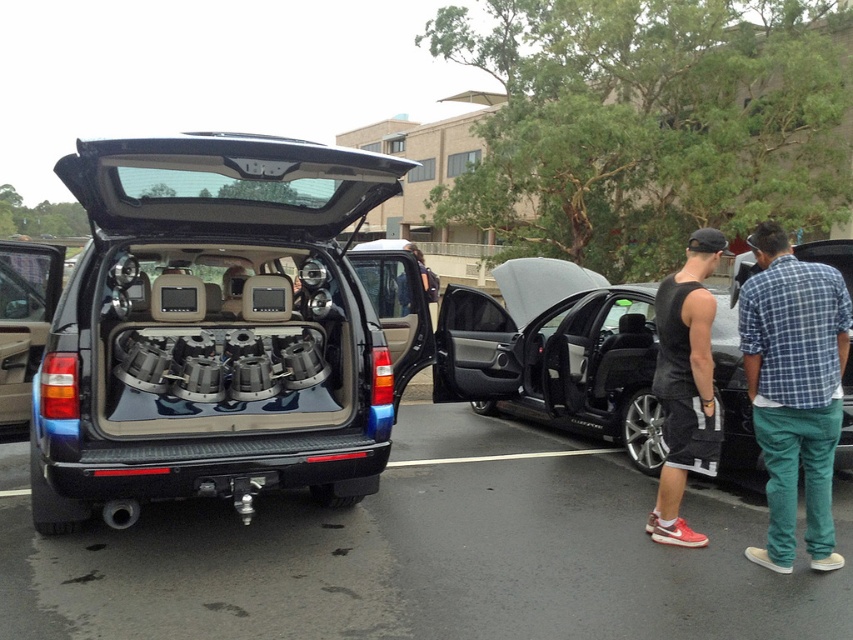
You are a delivery person standing at the camera position. You need to deliver a package to the shiny metallic minivan at center. The package requires a clear path of at least 3 meters to reach the vehicle. Is the distance sufficient for you to deliver the package without moving any other objects?

The shiny metallic minivan at center is 3.14 meters from camera. Since the required clear path is at least 3 meters, the distance is sufficient for delivery without moving any other objects.

You are a delivery person who needs to place a large package between the black plastic car at center and the blue plaid shirt at right. Which object should you place the package closer to if you want it to be near the smaller object?

The black plastic car at center is smaller than the blue plaid shirt at right, so you should place the package closer to the black plastic car at center.

You are a delivery person who needs to place a package on the highest point between the black plastic car at center and the blue plaid shirt at right. Where should you place it?

The blue plaid shirt at right is higher than the black plastic car at center, so place the package on the blue plaid shirt at right.